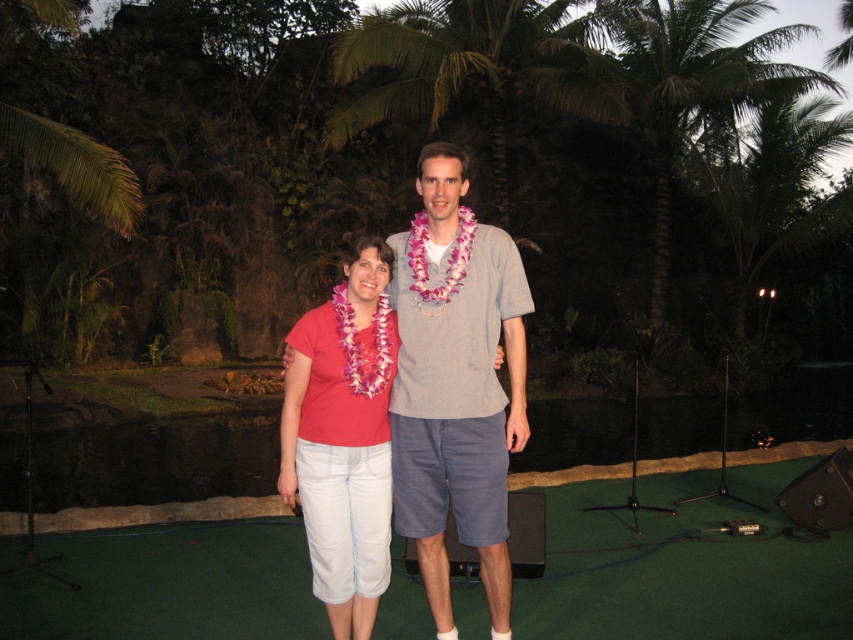
Question: Does green leafy palm tree at upper center have a greater width compared to green leafy palm tree at upper right?

Choices:
 (A) no
 (B) yes

Answer: (B)

Question: Can you confirm if green turf at center is bigger than matte pink shirt at center?

Choices:
 (A) yes
 (B) no

Answer: (A)

Question: Estimate the real-world distances between objects in this image. Which object is closer to the gray cotton shirt at center?

Choices:
 (A) green leafy palm tree at upper center
 (B) green turf at center
 (C) green leafy palm tree at upper right

Answer: (B)

Question: Among these objects, which one is nearest to the camera?

Choices:
 (A) gray cotton shirt at center
 (B) matte pink shirt at center
 (C) green turf at center

Answer: (B)

Question: Is green turf at center thinner than green leafy palm tree at upper center?

Choices:
 (A) yes
 (B) no

Answer: (B)

Question: Which point is closer to the camera taking this photo?

Choices:
 (A) (772, 97)
 (B) (370, 540)
 (C) (618, 100)
 (D) (691, 545)

Answer: (B)